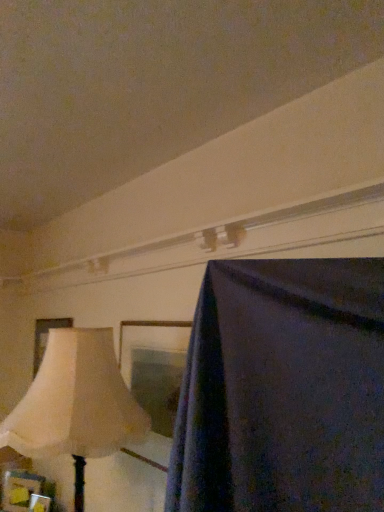
Question: Does wooden picture frame at lower left, acting as the 1th picture frame starting from the front, have a lesser width compared to matte cream picture frame at left, the third picture frame when ordered from bottom to top?

Choices:
 (A) no
 (B) yes

Answer: (A)

Question: Does wooden picture frame at lower left, placed as the second picture frame when sorted from top to bottom, have a lesser height compared to matte cream picture frame at left, which is the third picture frame from front to back?

Choices:
 (A) no
 (B) yes

Answer: (B)

Question: From a real-world perspective, is wooden picture frame at lower left, placed as the second picture frame when sorted from top to bottom, positioned under matte cream picture frame at left, the 1th picture frame in the top-to-bottom sequence, based on gravity?

Choices:
 (A) no
 (B) yes

Answer: (B)

Question: Can you confirm if wooden picture frame at lower left, placed as the second picture frame when sorted from top to bottom, is wider than matte cream picture frame at left, which is the third picture frame from front to back?

Choices:
 (A) no
 (B) yes

Answer: (B)

Question: Can you confirm if wooden picture frame at lower left, acting as the 1th picture frame starting from the front, is smaller than matte cream picture frame at left, the third picture frame when ordered from bottom to top?

Choices:
 (A) yes
 (B) no

Answer: (A)

Question: Is wooden picture frame at lower left, which appears as the third picture frame when viewed from the back, positioned behind matte cream picture frame at left, the first picture frame when ordered from back to front?

Choices:
 (A) no
 (B) yes

Answer: (A)

Question: Could wooden picture frame at lower left, the first picture frame when ordered from bottom to top, be considered to be inside wooden picture frame at lower left, acting as the 1th picture frame starting from the front?

Choices:
 (A) no
 (B) yes

Answer: (A)

Question: Considering the relative positions of wooden picture frame at lower left, marked as the second picture frame in a bottom-to-top arrangement, and wooden picture frame at lower left, the first picture frame when ordered from bottom to top, in the image provided, is wooden picture frame at lower left, marked as the second picture frame in a bottom-to-top arrangement, behind wooden picture frame at lower left, the first picture frame when ordered from bottom to top,?

Choices:
 (A) yes
 (B) no

Answer: (B)

Question: Considering the relative sizes of wooden picture frame at lower left, acting as the 1th picture frame starting from the front, and wooden picture frame at lower left, the 2th picture frame from the back, in the image provided, is wooden picture frame at lower left, acting as the 1th picture frame starting from the front, taller than wooden picture frame at lower left, the 2th picture frame from the back,?

Choices:
 (A) yes
 (B) no

Answer: (B)

Question: From the image's perspective, is wooden picture frame at lower left, placed as the second picture frame when sorted from top to bottom, under wooden picture frame at lower left, the first picture frame when ordered from bottom to top?

Choices:
 (A) yes
 (B) no

Answer: (B)

Question: From a real-world perspective, is wooden picture frame at lower left, acting as the 1th picture frame starting from the front, positioned over wooden picture frame at lower left, the 2th picture frame from the back, based on gravity?

Choices:
 (A) no
 (B) yes

Answer: (A)

Question: Is wooden picture frame at lower left, which appears as the third picture frame when viewed from the back, not inside wooden picture frame at lower left, placed as the second picture frame when sorted from front to back?

Choices:
 (A) yes
 (B) no

Answer: (A)

Question: Could you tell me if beige fabric lampshade at left is facing wooden picture frame at lower left, marked as the second picture frame in a bottom-to-top arrangement?

Choices:
 (A) no
 (B) yes

Answer: (A)